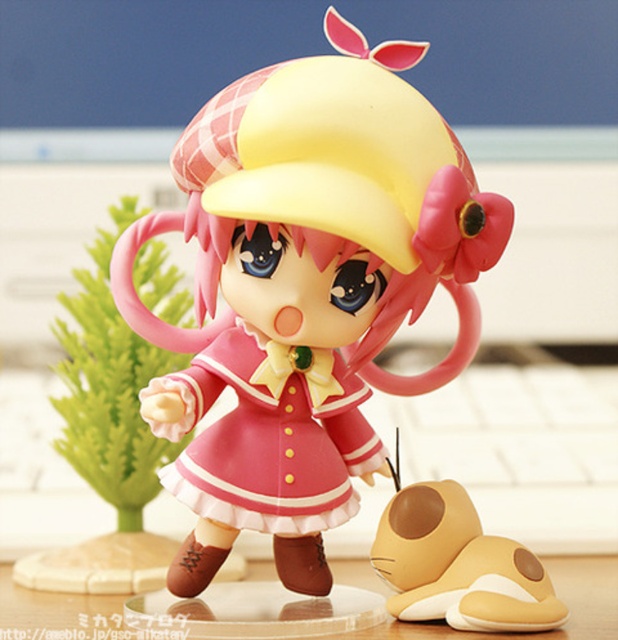
The image size is (618, 640). What do you see at coordinates (455, 563) in the screenshot?
I see `brown matte plush slippers at lower right` at bounding box center [455, 563].

Does brown matte plush slippers at lower right have a greater width compared to transparent acrylic table at center?

Incorrect, brown matte plush slippers at lower right's width does not surpass transparent acrylic table at center's.

Is point (396, 470) less distant than point (69, 604)?

Yes, it is in front of point (69, 604).

At what (x,y) coordinates should I click in order to perform the action: click on brown matte plush slippers at lower right. Please return your answer as a coordinate pair (x, y). Looking at the image, I should click on (455, 563).

Can you confirm if matte pink plastic doll at center is positioned to the left of transparent acrylic table at center?

Indeed, matte pink plastic doll at center is positioned on the left side of transparent acrylic table at center.

Can you confirm if matte pink plastic doll at center is taller than transparent acrylic table at center?

Yes.

Is point (192, 593) positioned before point (609, 595)?

Yes, it is in front of point (609, 595).

Where is `matte pink plastic doll at center`? The width and height of the screenshot is (618, 640). matte pink plastic doll at center is located at coordinates (305, 291).

Is point (240, 515) farther from camera compared to point (502, 572)?

Yes.

Identify the location of pink matte dress at center. The height and width of the screenshot is (640, 618). (268, 436).